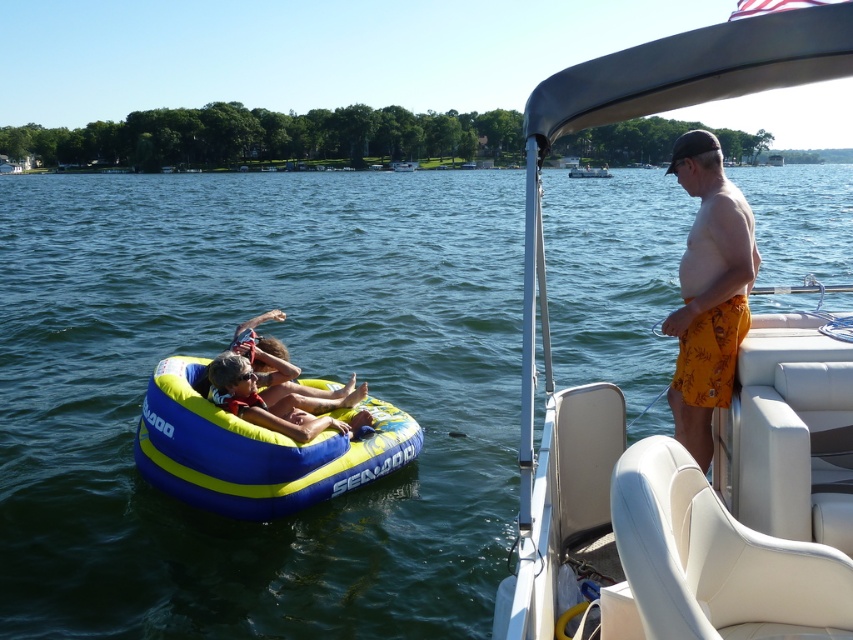
You are planning to take a group of four people for a water activity. You have two options for floating devices available in the scene. The blue inflatable tube at center and the yellow fabric float at center. Based on their sizes, which one can accommodate more people?

The blue inflatable tube at center can accommodate more people because its width is larger than the yellow fabric float at center.

You are a swimmer who wants to know which object is taller between the blue inflatable tube at center and the yellow fabric float at center. Can you tell me which one is taller?

The blue inflatable tube at center is much taller than the yellow fabric float at center according to the description.